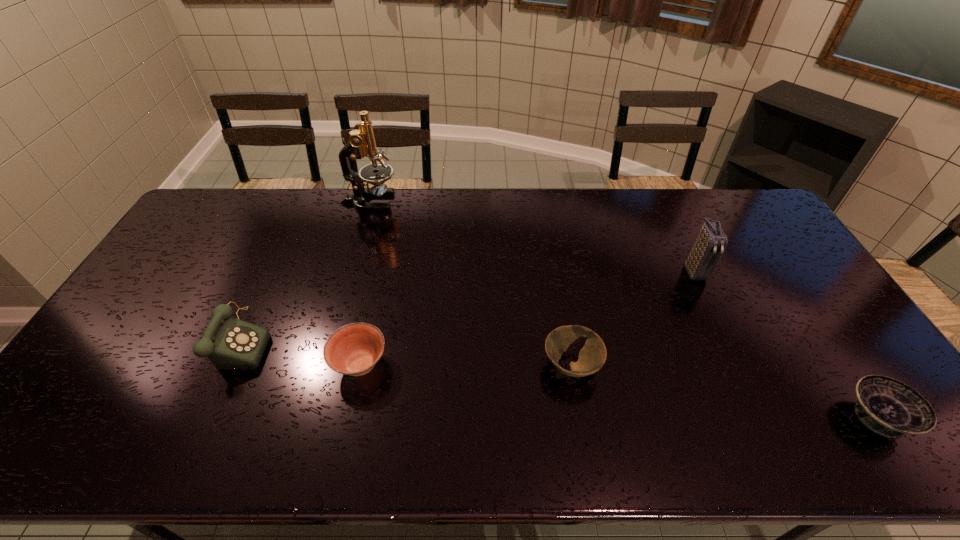
The image size is (960, 540). I want to click on vacant area situated 0.080m with the zip open on the fifth shortest object, so click(710, 305).

In order to click on vacant space located 0.350m on the dial of the fourth shortest object in this screenshot , I will do `click(398, 340)`.

This screenshot has width=960, height=540. What are the coordinates of `vacant space located on the back of the leftmost bowl` in the screenshot? It's located at (380, 273).

At what (x,y) coordinates should I click in order to perform the action: click on free location located 0.050m on the back of the third object from right to left. Please return your answer as a coordinate pair (x, y). Looking at the image, I should click on (564, 327).

Locate an element on the screen. The width and height of the screenshot is (960, 540). blank space located on the back of the rightmost bowl is located at coordinates (787, 282).

This screenshot has width=960, height=540. Find the location of `object that is at the far edge`. object that is at the far edge is located at coordinates (361, 143).

Find the location of `object positioned at the near edge`. object positioned at the near edge is located at coordinates (888, 407).

This screenshot has height=540, width=960. I want to click on object that is positioned at the right edge, so click(x=888, y=407).

You are a GUI agent. You are given a task and a screenshot of the screen. Output one action in this format:
    pyautogui.click(x=<x>, y=<y>)
    Task: Click on the object present at the near right corner
    
    Given the screenshot: What is the action you would take?
    pyautogui.click(x=888, y=407)

At what (x,y) coordinates should I click in order to perform the action: click on free space at the far edge of the desktop. Please return your answer as a coordinate pair (x, y). The image size is (960, 540). Looking at the image, I should click on (591, 204).